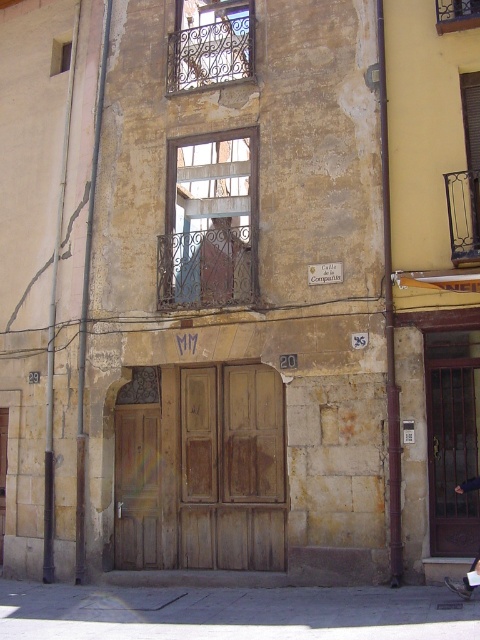
You are a delivery person trying to deliver a package to apartment 29. The package requires a space wider than the metallic wrought iron window at upper right to fit through. Can the wooden door at center accommodate the package?

The wooden door at center has a larger width than the metallic wrought iron window at upper right, so the wooden door at center can accommodate the package.

You are a delivery person trying to deliver a package to apartment 29. You see the wooden door at center and the wrought iron window at upper center. Which one is the correct entrance to apartment 29?

The wooden door at center is the correct entrance to apartment 29 because it is larger in size than the wrought iron window at upper center and has the number 29 sign above it.